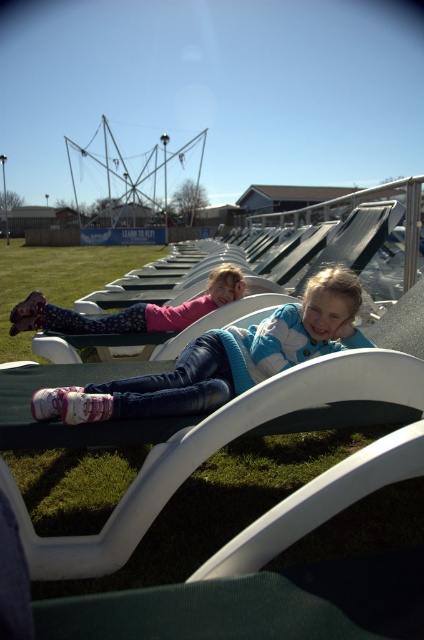
Question: Which of these objects is positioned closest to the blue striped sweater at center?

Choices:
 (A) matte pink sweater at center
 (B) green grass at center

Answer: (A)

Question: Is the position of green grass at center less distant than that of matte pink sweater at center?

Choices:
 (A) no
 (B) yes

Answer: (A)

Question: Estimate the real-world distances between objects in this image. Which object is closer to the green grass at center?

Choices:
 (A) blue striped sweater at center
 (B) matte pink sweater at center

Answer: (A)

Question: Is green grass at center closer to camera compared to matte pink sweater at center?

Choices:
 (A) yes
 (B) no

Answer: (B)

Question: Can you confirm if blue striped sweater at center is positioned to the left of matte pink sweater at center?

Choices:
 (A) no
 (B) yes

Answer: (A)

Question: Which point appears closest to the camera in this image?

Choices:
 (A) (197, 362)
 (B) (239, 269)

Answer: (A)